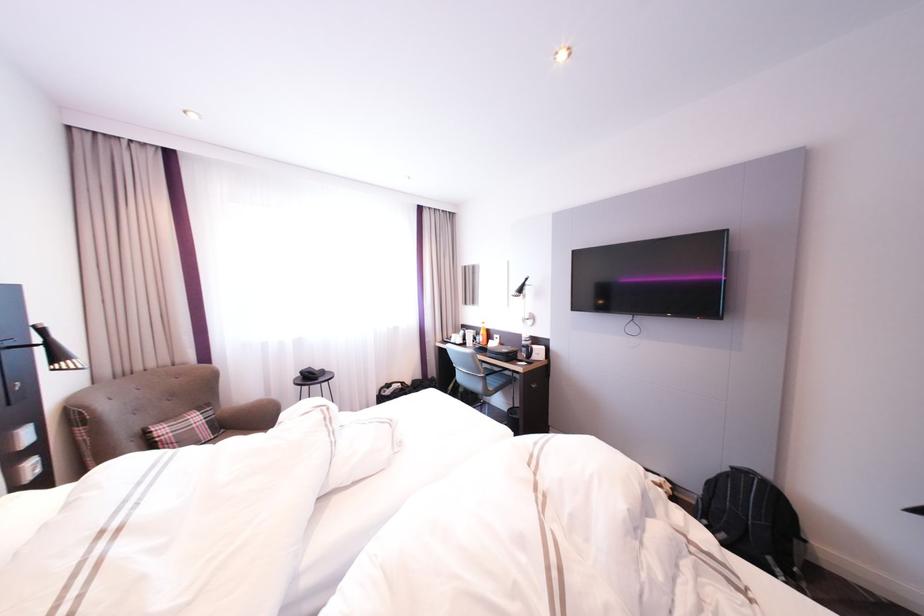
The image size is (924, 616). Describe the element at coordinates (50, 350) in the screenshot. I see `the black lamp head` at that location.